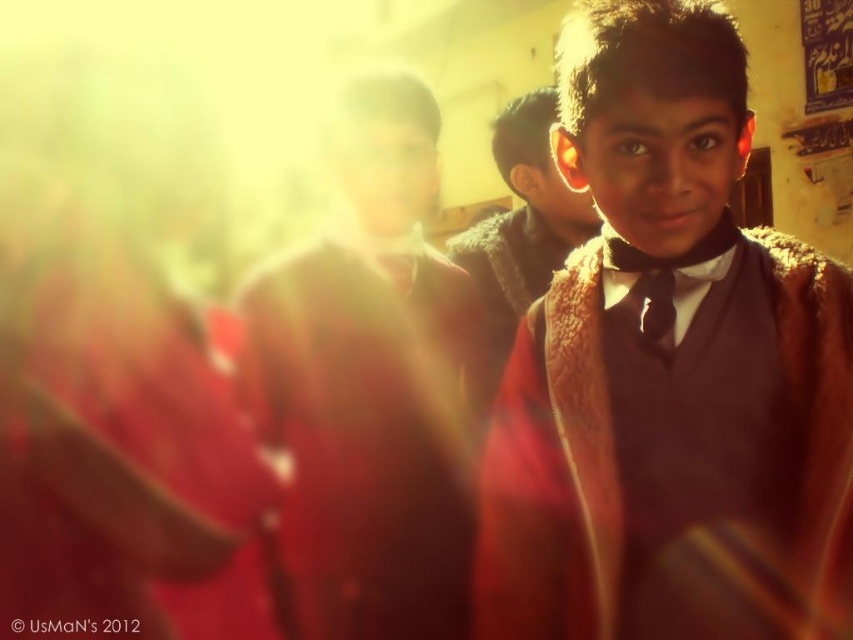
Which is more to the right, brown woolen sweater at center or black satin tie at center?

brown woolen sweater at center is more to the right.

Between brown woolen sweater at center and black satin tie at center, which one appears on the left side from the viewer's perspective?

From the viewer's perspective, black satin tie at center appears more on the left side.

Identify the location of brown woolen sweater at center. (669, 372).

At what (x,y) coordinates should I click in order to perform the action: click on brown woolen sweater at center. Please return your answer as a coordinate pair (x, y). This screenshot has height=640, width=853. Looking at the image, I should click on (669, 372).

Can you confirm if brown woolen sweater at center is positioned above brown fuzzy coat at center?

No.

In the scene shown: Between brown woolen sweater at center and brown fuzzy coat at center, which one is positioned lower?

brown woolen sweater at center

Which is in front, point (532, 428) or point (566, 208)?

Positioned in front is point (532, 428).

Locate an element on the screen. brown woolen sweater at center is located at coordinates (669, 372).

What do you see at coordinates (366, 438) in the screenshot? The height and width of the screenshot is (640, 853). I see `matte red robe at center` at bounding box center [366, 438].

In the scene shown: Does matte red robe at center have a larger size compared to brown fuzzy coat at center?

No, matte red robe at center is not bigger than brown fuzzy coat at center.

Identify the location of matte red robe at center. tap(366, 438).

This screenshot has height=640, width=853. In order to click on matte red robe at center in this screenshot , I will do `click(366, 438)`.